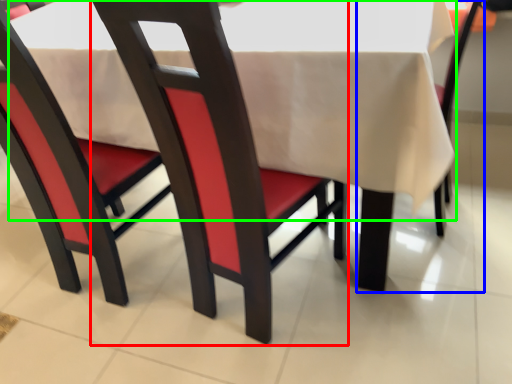
Question: Which object is positioned closest to chair (highlighted by a red box)? Select from chair (highlighted by a blue box) and tablecloth (highlighted by a green box).

Choices:
 (A) chair
 (B) tablecloth

Answer: (B)